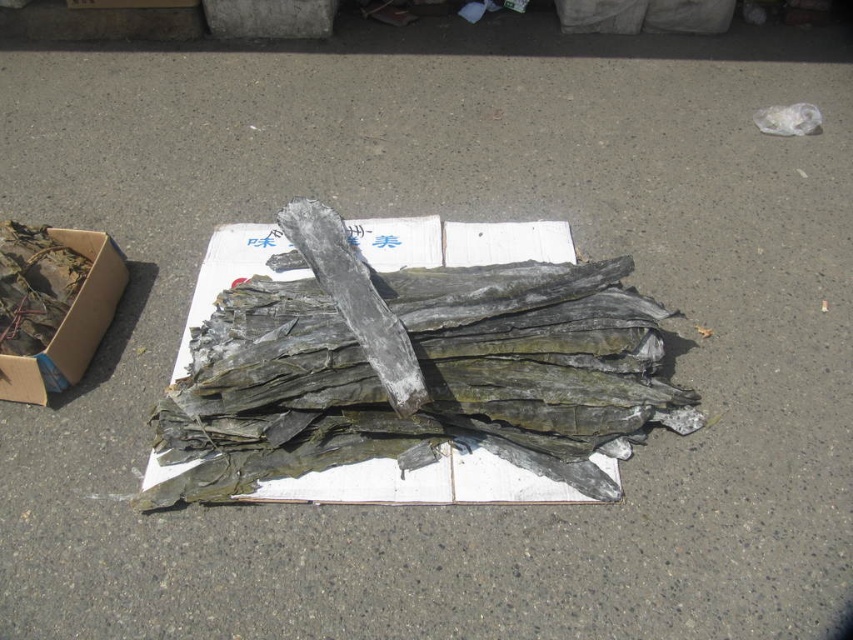
Does greenish-gray wood at center have a smaller size compared to brown cardboard box at left?

Actually, greenish-gray wood at center might be larger than brown cardboard box at left.

Between greenish-gray wood at center and brown cardboard box at left, which one has more height?

With more height is greenish-gray wood at center.

Image resolution: width=853 pixels, height=640 pixels. I want to click on greenish-gray wood at center, so click(413, 358).